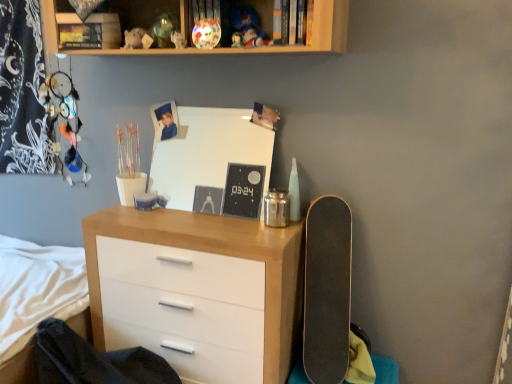
Identify the location of vacant space situated above wooden chest of drawers at center (from a real-world perspective). pyautogui.click(x=189, y=215).